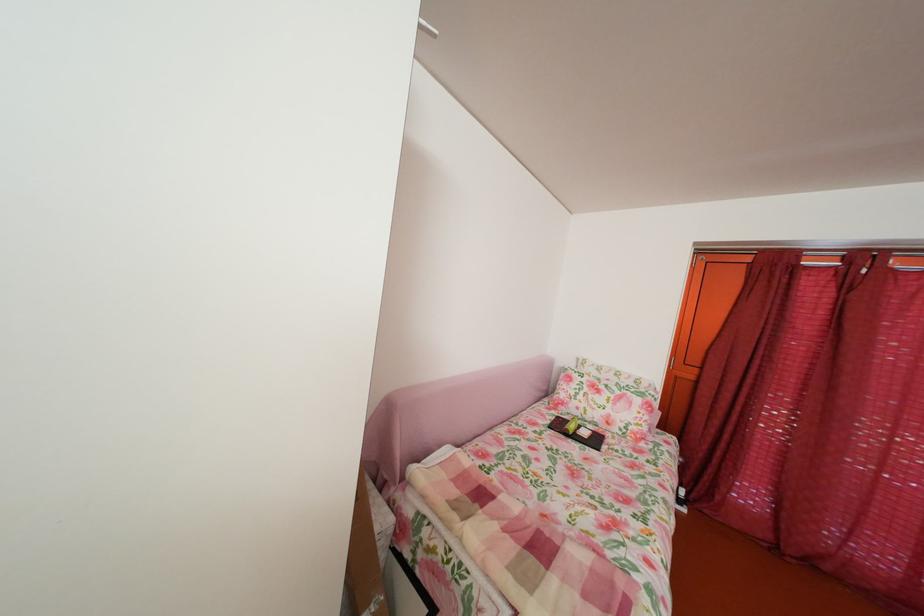
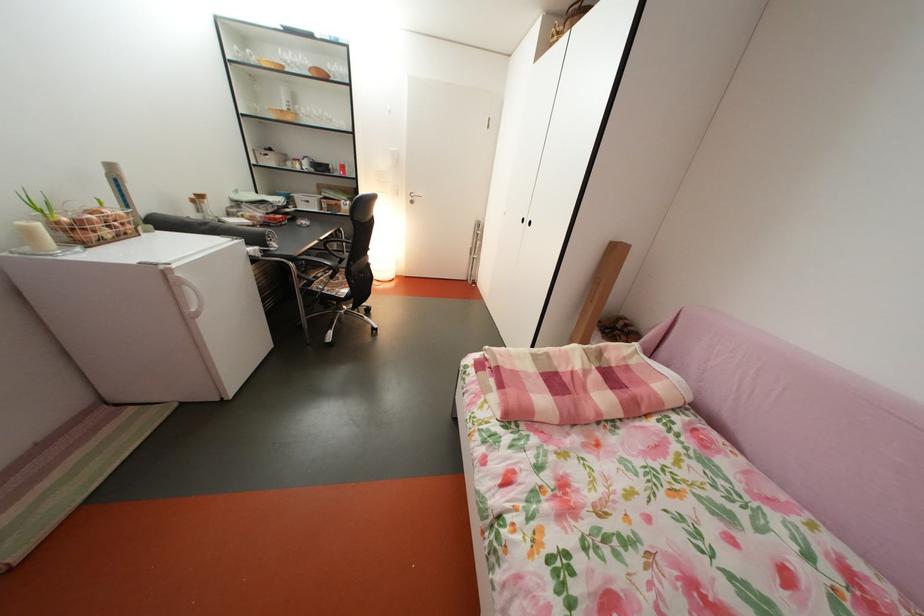
The point at [492,517] is marked in the first image. Where is the corresponding point in the second image?

(604, 374)